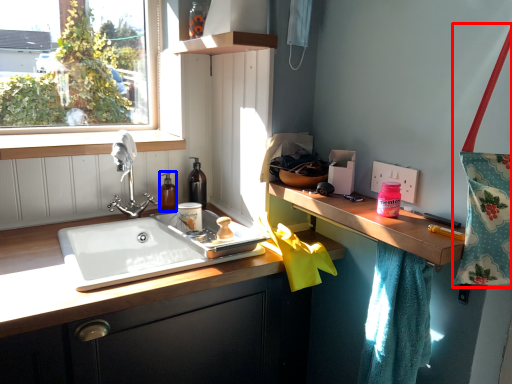
Question: Which object is closer to the camera taking this photo, tote bag (highlighted by a red box) or toiletry (highlighted by a blue box)?

Choices:
 (A) tote bag
 (B) toiletry

Answer: (A)